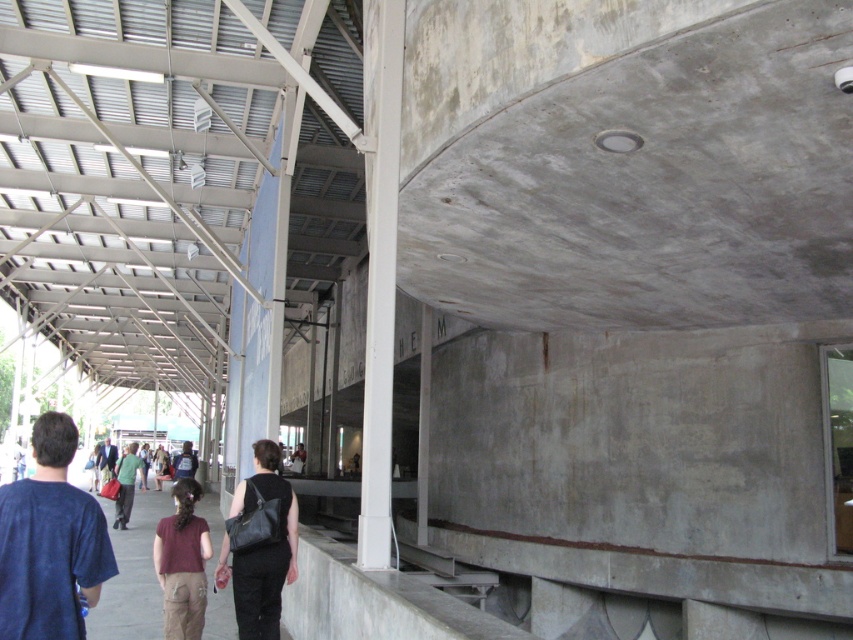
You are an event planner organizing a photoshoot in this industrial space. You need to position the blue cotton shirt at lower left and the green matte shirt at center in a way that maintains their size relationship. Which shirt should be placed closer to the camera to ensure the size difference remains visible?

The blue cotton shirt at lower left, which is smaller, should be placed closer to the camera. This way, its apparent size will be maintained relative to the green matte shirt at center, ensuring the size difference remains visible.

You are standing at the entrance of this industrial space and see the point marked at coordinates [260,548]. What object is located at that point?

The point at coordinates [260,548] marks the location of the black leather bag at lower center.

You are standing in the industrial space and want to determine which of the two points, point (30, 483) or point (161, 474), is closer to you. Based on the coordinates provided, which point is nearer?

Point (30, 483) is closer to the camera than point (161, 474), so it is the nearer point.